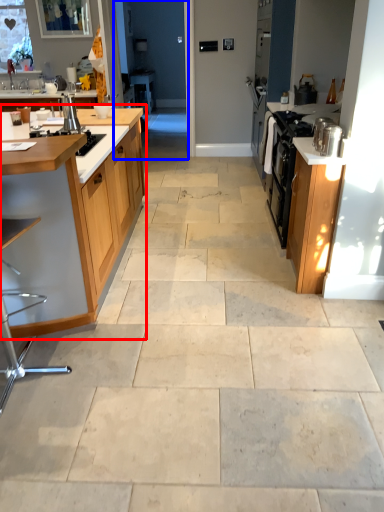
Question: Which of the following is the closest to the observer, cabinetry (highlighted by a red box) or screen door (highlighted by a blue box)?

Choices:
 (A) cabinetry
 (B) screen door

Answer: (A)